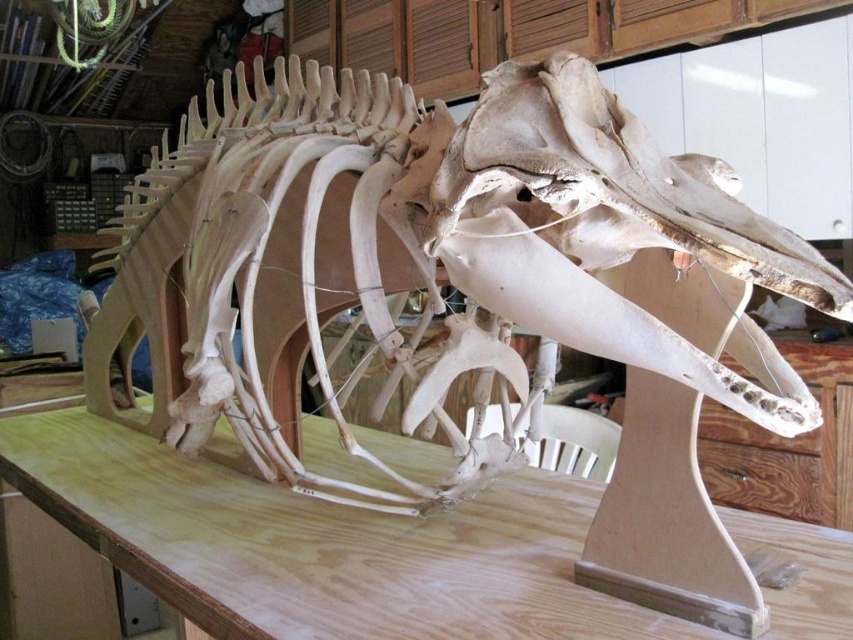
Question: Can you confirm if bone-like skeleton at center is positioned above white bone skull at center?

Choices:
 (A) no
 (B) yes

Answer: (B)

Question: Among these points, which one is farthest from the camera?

Choices:
 (A) (334, 304)
 (B) (720, 390)
 (C) (350, 632)

Answer: (A)

Question: Does bone-like skeleton at center appear under white bone skull at center?

Choices:
 (A) yes
 (B) no

Answer: (B)

Question: Which point appears farthest from the camera in this image?

Choices:
 (A) (498, 579)
 (B) (485, 289)
 (C) (827, 260)

Answer: (A)

Question: Among these objects, which one is nearest to the camera?

Choices:
 (A) plywood table at center
 (B) white bone skull at center

Answer: (B)

Question: Is bone-like skeleton at center thinner than white bone skull at center?

Choices:
 (A) yes
 (B) no

Answer: (B)